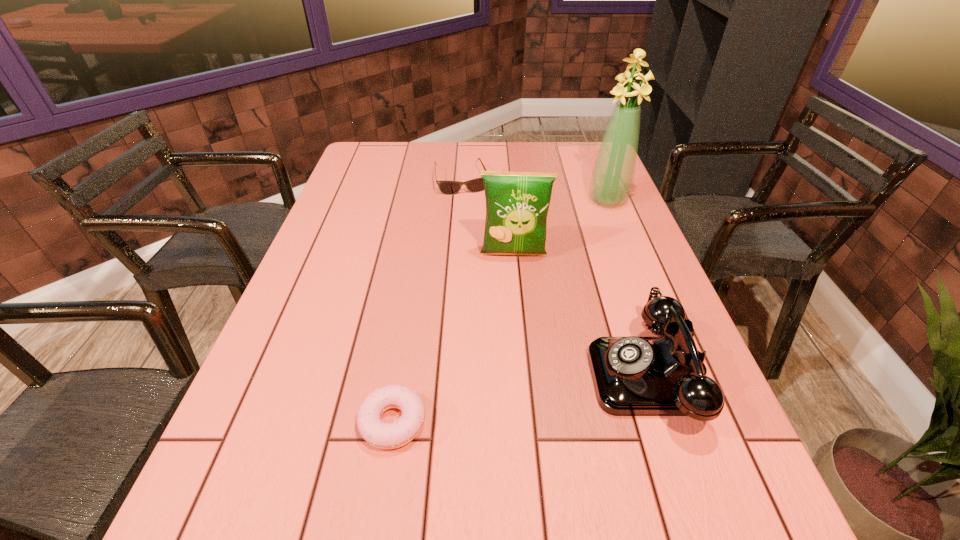
Locate an element on the screen. doughnut located in the near edge section of the desktop is located at coordinates (382, 435).

At what (x,y) coordinates should I click in order to perform the action: click on telephone located in the near edge section of the desktop. Please return your answer as a coordinate pair (x, y). The height and width of the screenshot is (540, 960). Looking at the image, I should click on (633, 376).

The image size is (960, 540). Identify the location of telephone positioned at the right edge. (633, 376).

Where is `bouquet located at the right edge`? This screenshot has height=540, width=960. bouquet located at the right edge is located at coordinates (613, 173).

Identify the location of object at the near right corner. The width and height of the screenshot is (960, 540). (633, 376).

Where is `vacant position at the far edge of the desktop`? vacant position at the far edge of the desktop is located at coordinates (486, 143).

Identify the location of vacant space at the left edge of the desktop. The image size is (960, 540). (345, 259).

At what (x,y) coordinates should I click in order to perform the action: click on vacant space at the right edge of the desktop. Please return your answer as a coordinate pair (x, y). Looking at the image, I should click on [610, 225].

In the image, there is a desktop. In order to click on vacant space at the far left corner in this screenshot , I will do `click(358, 164)`.

Identify the location of vacant space at the near left corner of the desktop. (232, 434).